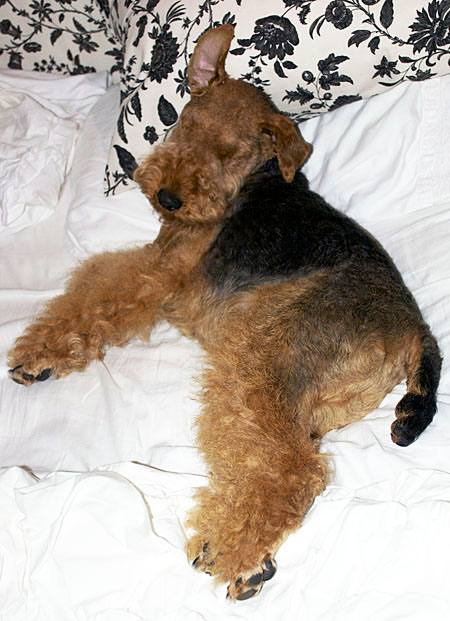
Find the location of `wrinkles in sheet`. wrinkles in sheet is located at coordinates (348, 130), (364, 130), (110, 388).